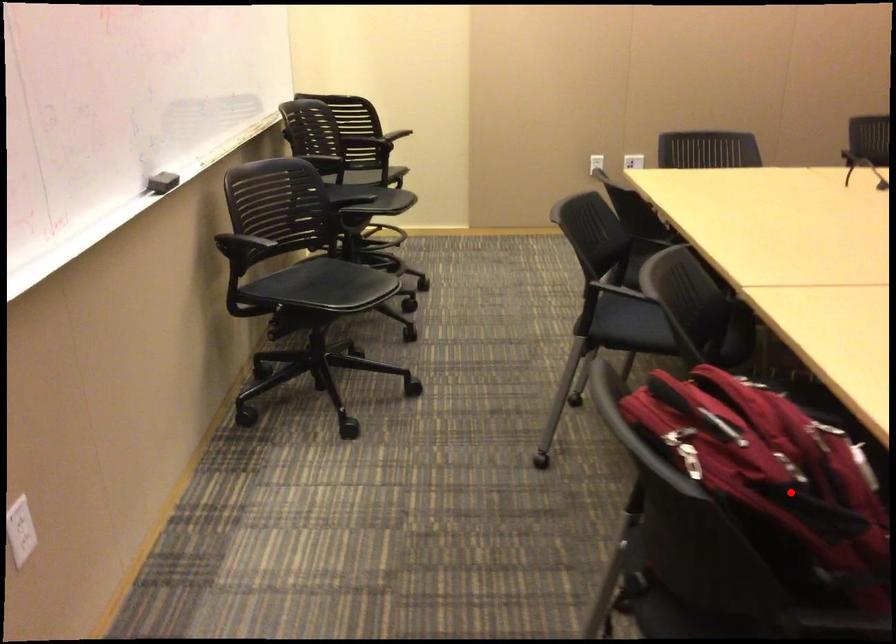
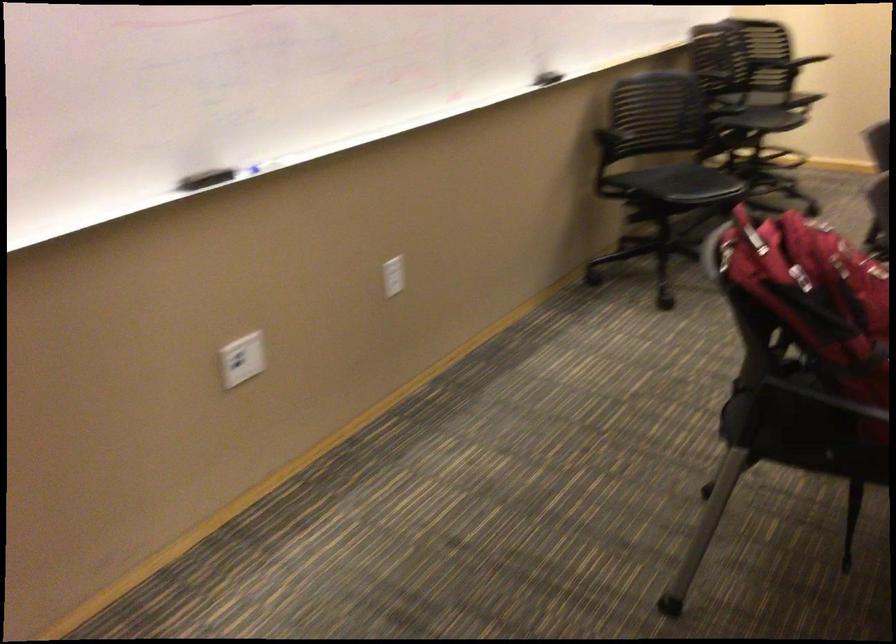
Question: A red point is marked in image1. In image2, is the corresponding 3D point closer to the camera or farther? Reply with the corresponding letter.

Choices:
 (A) The corresponding 3D point is closer.
 (B) The corresponding 3D point is farther.

Answer: (B)